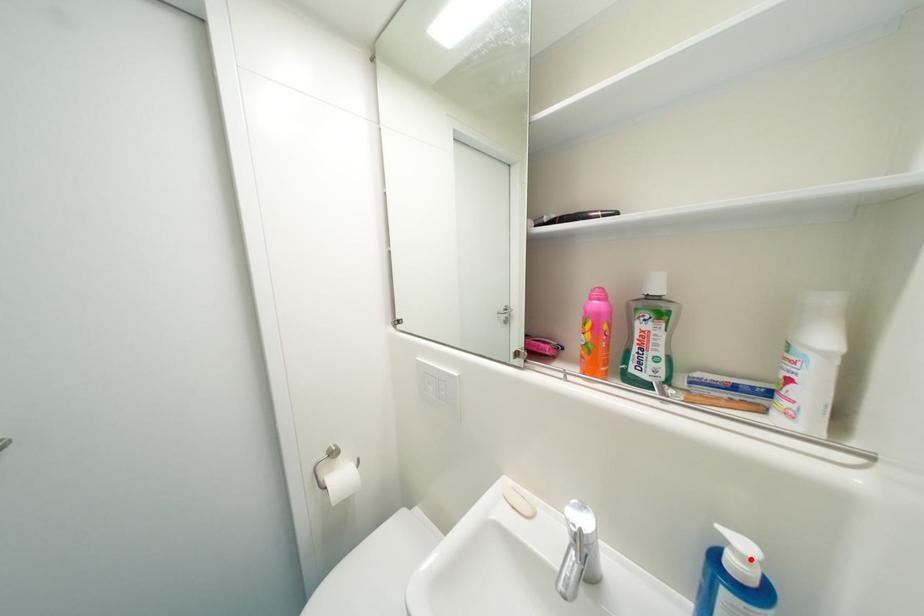
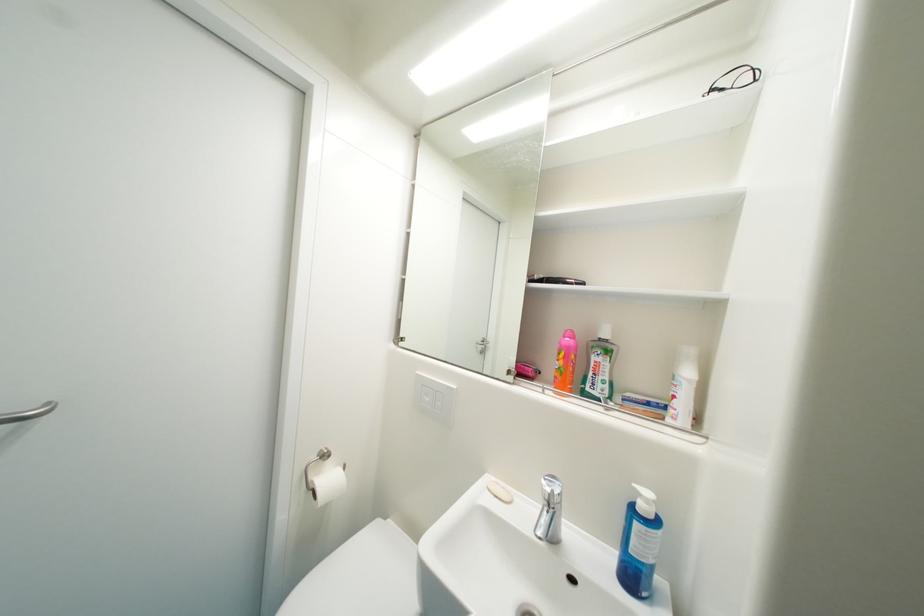
The point at the highlighted location is marked in the first image. Where is the corresponding point in the second image?

(653, 503)